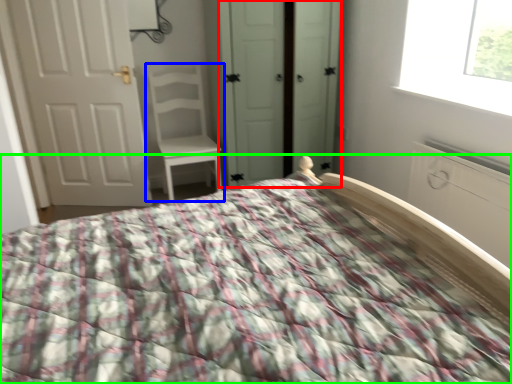
Question: Considering the real-world distances, which object is closest to screen door (highlighted by a red box)? chair (highlighted by a blue box) or bed (highlighted by a green box).

Choices:
 (A) chair
 (B) bed

Answer: (A)